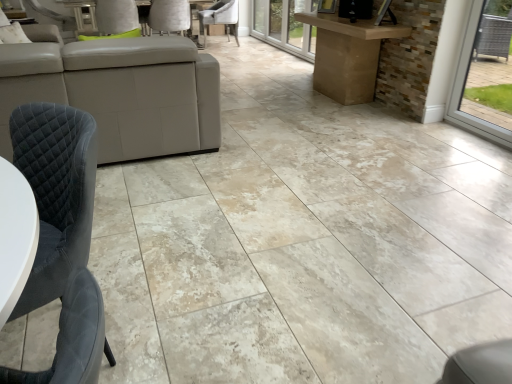
Question: Is velvet grey chair at lower left, acting as the first chair starting from the front, inside the boundaries of velvet grey chair at center, the first chair from the top, or outside?

Choices:
 (A) inside
 (B) outside

Answer: (B)

Question: From a real-world perspective, relative to velvet grey chair at center, the 3th chair when ordered from front to back, is velvet grey chair at lower left, acting as the first chair starting from the front, vertically above or below?

Choices:
 (A) above
 (B) below

Answer: (A)

Question: Considering the real-world distances, which object is farthest from the transparent glass door at upper center?

Choices:
 (A) velvet grey chair at lower left, which appears as the 1th chair when ordered from the bottom
 (B) velvet grey chair at center, acting as the third chair starting from the bottom
 (C) white leather chair at upper center, which appears as the 2th chair when viewed from the front

Answer: (A)

Question: Estimate the real-world distances between objects in this image. Which object is closer to the velvet grey chair at center, the first chair positioned from the back?

Choices:
 (A) white leather chair at upper center, which appears as the 2th chair when viewed from the front
 (B) transparent glass door at upper center
 (C) velvet grey chair at lower left, which appears as the 1th chair when ordered from the bottom

Answer: (B)